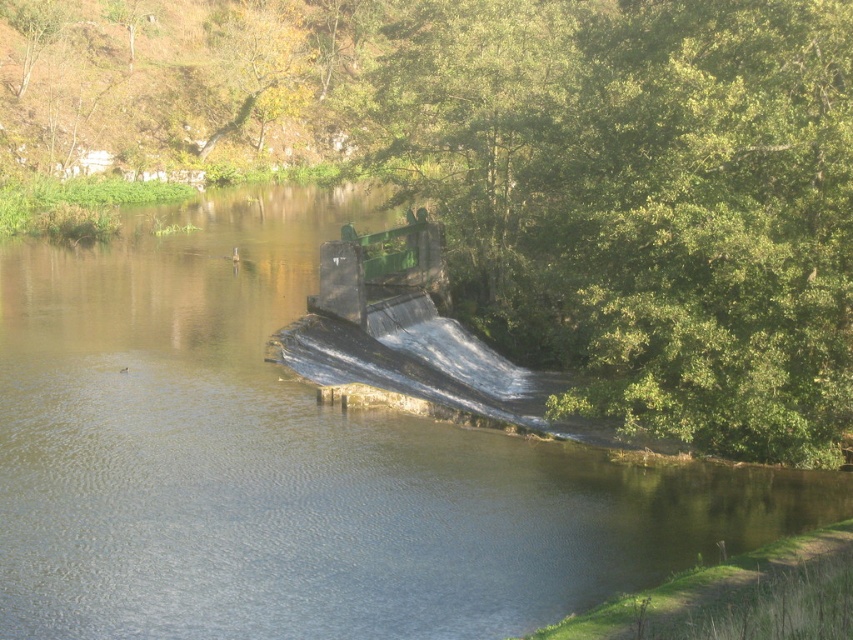
Question: Which object appears closest to the camera in this image?

Choices:
 (A) green concrete dam at center
 (B) green leafy tree at center

Answer: (A)

Question: Does green leafy tree at center have a larger size compared to green concrete dam at center?

Choices:
 (A) no
 (B) yes

Answer: (B)

Question: Considering the relative positions of green leafy tree at center and green concrete dam at center in the image provided, where is green leafy tree at center located with respect to green concrete dam at center?

Choices:
 (A) below
 (B) above

Answer: (B)

Question: Which point appears farthest from the camera in this image?

Choices:
 (A) [x=341, y=332]
 (B) [x=293, y=227]

Answer: (B)

Question: Considering the relative positions of green leafy tree at center and green concrete dam at center in the image provided, where is green leafy tree at center located with respect to green concrete dam at center?

Choices:
 (A) above
 (B) below

Answer: (A)